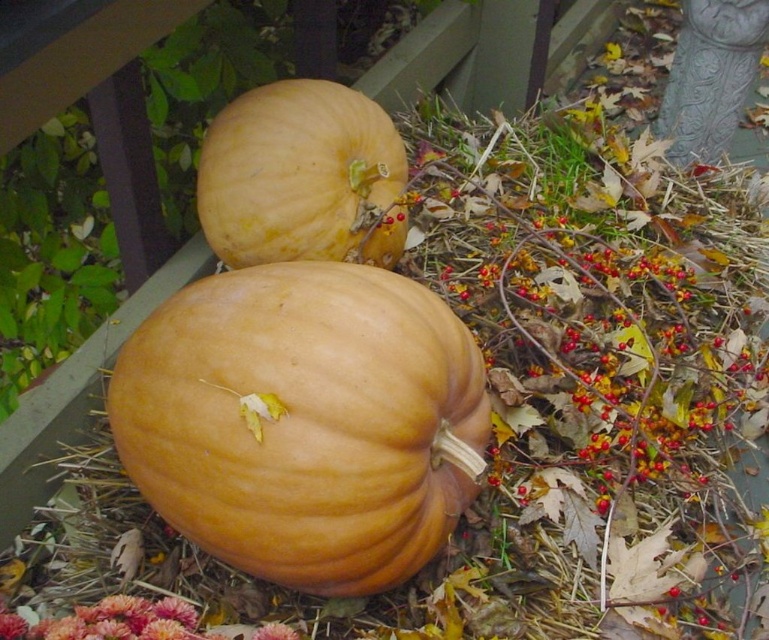
Is matte orange pumpkin at center in front of matte orange pumpkin at upper center?

Yes, matte orange pumpkin at center is closer to the viewer.

Which of these two, matte orange pumpkin at center or matte orange pumpkin at upper center, stands shorter?

matte orange pumpkin at upper center is shorter.

Locate an element on the screen. matte orange pumpkin at center is located at coordinates (305, 420).